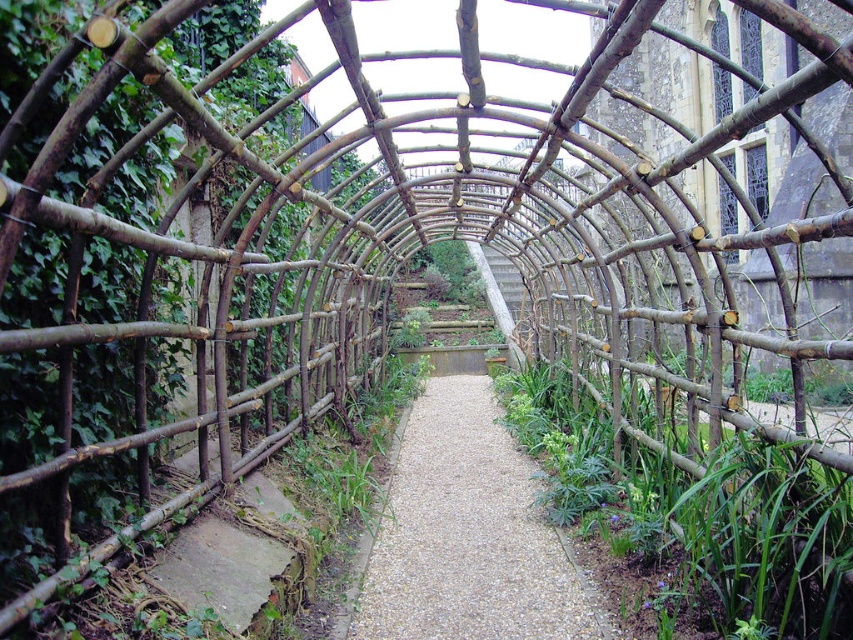
Between gravelly stone path at center and green leafy plant at center, which one is positioned lower?

gravelly stone path at center is lower down.

Does gravelly stone path at center have a greater width compared to green leafy plant at center?

Incorrect, gravelly stone path at center's width does not surpass green leafy plant at center's.

Who is more forward, (x=519, y=465) or (x=445, y=250)?

Positioned in front is point (x=519, y=465).

I want to click on gravelly stone path at center, so click(x=468, y=536).

Between point (386, 186) and point (431, 269), which one is positioned in front?

Point (386, 186) is more forward.

Who is positioned more to the left, natural wood trellis at left or green leafy plant at center?

Positioned to the left is natural wood trellis at left.

You are a GUI agent. You are given a task and a screenshot of the screen. Output one action in this format:
    pyautogui.click(x=<x>, y=<y>)
    Task: Click on the natural wood trellis at left
    The image size is (853, 640).
    Given the screenshot: What is the action you would take?
    pyautogui.click(x=200, y=280)

Where is `natural wood trellis at left`? The width and height of the screenshot is (853, 640). natural wood trellis at left is located at coordinates (x=200, y=280).

Is natural wood trellis at left wider than gravelly stone path at center?

Indeed, natural wood trellis at left has a greater width compared to gravelly stone path at center.

The width and height of the screenshot is (853, 640). I want to click on natural wood trellis at left, so click(x=200, y=280).

Locate an element on the screen. natural wood trellis at left is located at coordinates (200, 280).

Where is `natural wood trellis at left`? natural wood trellis at left is located at coordinates (200, 280).